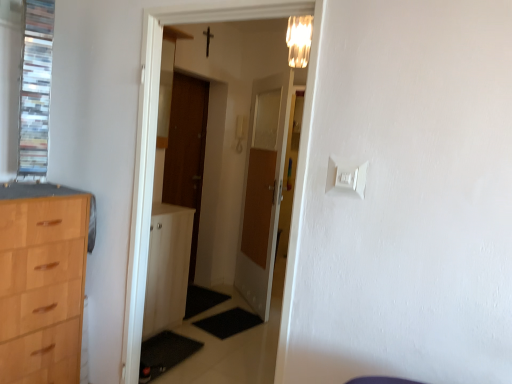
Describe the element at coordinates (229, 322) in the screenshot. The width and height of the screenshot is (512, 384). I see `black rubber mat at lower center` at that location.

Measure the distance between point (249, 204) and camera.

Point (249, 204) and camera are 12.81 feet apart from each other.

This screenshot has height=384, width=512. In order to click on metallic cross at upper center in this screenshot , I will do `click(208, 40)`.

Describe the element at coordinates (25, 87) in the screenshot. I see `clear glass window at upper left` at that location.

What do you see at coordinates (167, 267) in the screenshot? The width and height of the screenshot is (512, 384). I see `white glossy cabinet at center` at bounding box center [167, 267].

This screenshot has width=512, height=384. What are the coordinates of `white glossy door at center` in the screenshot? It's located at (155, 141).

Between clear glass window at upper left and white glossy door at center, which one has larger width?

clear glass window at upper left.

Which object is positioned more to the right, clear glass window at upper left or white glossy door at center?

white glossy door at center.

From the image's perspective, which one is positioned lower, clear glass window at upper left or white glossy door at center?

white glossy door at center, from the image's perspective.

Which object is further away from the camera taking this photo, clear glass window at upper left or white glossy door at center?

clear glass window at upper left.

Can you confirm if white plastic light switch at upper center is taller than wooden door at center, the 2th door in the right-to-left sequence?

In fact, white plastic light switch at upper center may be shorter than wooden door at center, the 2th door in the right-to-left sequence.

How far apart are white plastic light switch at upper center and wooden door at center, the 2th door in the right-to-left sequence?

The distance of white plastic light switch at upper center from wooden door at center, the 2th door in the right-to-left sequence, is 2.52 meters.

Is wooden door at center, the 2th door in the right-to-left sequence, at the back of white plastic light switch at upper center?

No, white plastic light switch at upper center's orientation is not away from wooden door at center, the 2th door in the right-to-left sequence.

Considering the positions of objects white plastic light switch at upper center and wooden door at center, the first door from the left, in the image provided, who is more to the left, white plastic light switch at upper center or wooden door at center, the first door from the left,?

wooden door at center, the first door from the left, is more to the left.

Is black rubber mat at lower center aimed at metallic cross at upper center?

No, black rubber mat at lower center is not oriented towards metallic cross at upper center.

Is point (243, 328) farther from camera compared to point (208, 44)?

No, it is not.

Considering the relative positions of black rubber mat at lower center and metallic cross at upper center in the image provided, is black rubber mat at lower center to the right of metallic cross at upper center from the viewer's perspective?

Indeed, black rubber mat at lower center is positioned on the right side of metallic cross at upper center.

From the picture: Is black rubber mat at lower center wider than metallic cross at upper center?

Indeed, black rubber mat at lower center has a greater width compared to metallic cross at upper center.

From the image's perspective, is white glossy door at center on clear glass window at upper left?

No, from the image's perspective, white glossy door at center is not above clear glass window at upper left.

From a real-world perspective, who is located higher, white glossy door at center or clear glass window at upper left?

From a 3D spatial view, clear glass window at upper left is above.

Considering the relative sizes of white glossy door at center and clear glass window at upper left in the image provided, is white glossy door at center thinner than clear glass window at upper left?

Correct, the width of white glossy door at center is less than that of clear glass window at upper left.

Is white glossy door at center to the left or to the right of clear glass window at upper left in the image?

Based on their positions, white glossy door at center is located to the right of clear glass window at upper left.

In terms of height, does wooden door at center, which is the first door from right to left, look taller or shorter compared to metallic cross at upper center?

Clearly, wooden door at center, which is the first door from right to left, is taller compared to metallic cross at upper center.

Can you see wooden door at center, which is the first door from right to left, touching metallic cross at upper center?

wooden door at center, which is the first door from right to left, is not next to metallic cross at upper center, and they're not touching.

Is wooden door at center, which is the first door from right to left, in front of or behind metallic cross at upper center in the image?

wooden door at center, which is the first door from right to left, is positioned closer to the viewer than metallic cross at upper center.

Consider the image. Is white plastic light switch at upper center aimed at wooden door at center, which is the first door from right to left?

No, white plastic light switch at upper center is not oriented towards wooden door at center, which is the first door from right to left.

From the picture: Which is correct: white plastic light switch at upper center is inside wooden door at center, which is the first door from right to left, or outside of it?

white plastic light switch at upper center is not inside wooden door at center, which is the first door from right to left, it's outside.

Does white plastic light switch at upper center touch wooden door at center, which is the first door from right to left?

No.

Identify the location of light switch that appears in front of the wooden door at center, which is the first door from right to left. This screenshot has height=384, width=512. (346, 177).

From the image's perspective, relative to white plastic light switch at upper center, is white glossy door at center above or below?

Clearly, from the image's perspective, white glossy door at center is below white plastic light switch at upper center.

Find the location of `corridor located behind the white plastic light switch at upper center`. corridor located behind the white plastic light switch at upper center is located at coordinates (155, 141).

Is white glossy door at center taller or shorter than white plastic light switch at upper center?

In the image, white glossy door at center appears to be taller than white plastic light switch at upper center.

I want to click on window positioned vertically above the white glossy door at center (from a real-world perspective), so click(25, 87).

Locate an element on the screen. light switch below the wooden door at center, the 2th door in the right-to-left sequence (from the image's perspective) is located at coordinates (346, 177).

Looking at the image, which one is located closer to metallic cross at upper center, matte glass light fixture at upper center or white glossy door at center?

The object closer to metallic cross at upper center is matte glass light fixture at upper center.

Based on their spatial positions, is matte glass light fixture at upper center or white glossy cabinet at center closer to wooden door at center, the second door in the left-to-right sequence?

white glossy cabinet at center is positioned closer to the anchor wooden door at center, the second door in the left-to-right sequence.

Which object lies further to the anchor point white glossy cabinet at center, clear glass window at upper left or black rubber mat at lower center?

clear glass window at upper left is positioned further to the anchor white glossy cabinet at center.

Based on the photo, from the image, which object appears to be nearer to white plastic light switch at upper center, wooden door at center, which is the first door from right to left, or wooden door at center, the 2th door in the right-to-left sequence?

wooden door at center, which is the first door from right to left, lies closer to white plastic light switch at upper center than the other object.

From the image, which object appears to be farther from metallic cross at upper center, white glossy cabinet at center or black rubber mat at lower center?

The object further to metallic cross at upper center is black rubber mat at lower center.

Considering their positions, is black rubber mat at lower center positioned further to metallic cross at upper center than matte glass light fixture at upper center?

Among the two, black rubber mat at lower center is located further to metallic cross at upper center.

Based on their spatial positions, is black rubber mat at lower center or white glossy door at center further from wooden door at center, the first door from the left?

white glossy door at center is further to wooden door at center, the first door from the left.

Estimate the real-world distances between objects in this image. Which object is closer to white glossy door at center, white glossy cabinet at center or clear glass window at upper left?

Based on the image, clear glass window at upper left appears to be nearer to white glossy door at center.

This screenshot has width=512, height=384. In order to click on corridor between clear glass window at upper left and matte glass light fixture at upper center in this screenshot , I will do `click(155, 141)`.

Where is `file cabinet between metallic cross at upper center and black rubber mat at lower center from top to bottom`? The height and width of the screenshot is (384, 512). file cabinet between metallic cross at upper center and black rubber mat at lower center from top to bottom is located at coordinates (167, 267).

The height and width of the screenshot is (384, 512). I want to click on door between metallic cross at upper center and wooden door at center, which is the first door from right to left, in the vertical direction, so click(x=186, y=150).

Locate an element on the screen. The image size is (512, 384). file cabinet between white plastic light switch at upper center and wooden door at center, the first door from the left, from front to back is located at coordinates (167, 267).